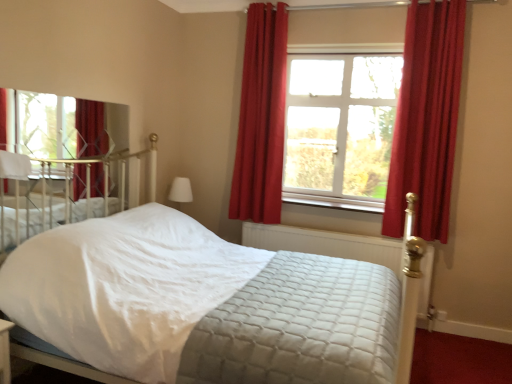
Question: From a real-world perspective, is quilted fabric mattress at center positioned under white quilted fabric bed at center based on gravity?

Choices:
 (A) no
 (B) yes

Answer: (B)

Question: Can white quilted fabric bed at center be found inside quilted fabric mattress at center?

Choices:
 (A) yes
 (B) no

Answer: (B)

Question: Could you tell me if quilted fabric mattress at center is facing white quilted fabric bed at center?

Choices:
 (A) no
 (B) yes

Answer: (B)

Question: Would you say quilted fabric mattress at center is a long distance from white quilted fabric bed at center?

Choices:
 (A) yes
 (B) no

Answer: (B)

Question: Can you confirm if quilted fabric mattress at center is positioned to the right of white quilted fabric bed at center?

Choices:
 (A) yes
 (B) no

Answer: (A)

Question: Looking at their shapes, would you say clear glass window at center, arranged as the first window when viewed from the back, is wider or thinner than white quilted fabric bed at center?

Choices:
 (A) thin
 (B) wide

Answer: (A)

Question: Relative to white quilted fabric bed at center, is clear glass window at center, the 1th window from the right, in front or behind?

Choices:
 (A) front
 (B) behind

Answer: (B)

Question: Is clear glass window at center, acting as the second window starting from the front, to the left or to the right of white quilted fabric bed at center in the image?

Choices:
 (A) left
 (B) right

Answer: (B)

Question: From the image's perspective, is clear glass window at center, acting as the second window starting from the front, located above or below white quilted fabric bed at center?

Choices:
 (A) above
 (B) below

Answer: (A)

Question: Considering the positions of quilted fabric mattress at center and clear glass window at center, which is the 2th window from left to right, in the image, is quilted fabric mattress at center taller or shorter than clear glass window at center, which is the 2th window from left to right,?

Choices:
 (A) tall
 (B) short

Answer: (B)

Question: Is point (358, 241) closer or farther from the camera than point (375, 94)?

Choices:
 (A) closer
 (B) farther

Answer: (A)

Question: From a real-world perspective, relative to clear glass window at center, acting as the second window starting from the front, is quilted fabric mattress at center vertically above or below?

Choices:
 (A) above
 (B) below

Answer: (B)

Question: Considering the relative positions of quilted fabric mattress at center and clear glass window at center, arranged as the first window when viewed from the back, in the image provided, is quilted fabric mattress at center to the left or to the right of clear glass window at center, arranged as the first window when viewed from the back,?

Choices:
 (A) right
 (B) left

Answer: (B)

Question: From the image's perspective, is clear glass mirror at upper left, which is counted as the 2th window, starting from the right, positioned above or below velvet red curtain at upper right, arranged as the 1th curtain when viewed from the left?

Choices:
 (A) below
 (B) above

Answer: (A)

Question: Is point (18, 124) closer or farther from the camera than point (241, 165)?

Choices:
 (A) closer
 (B) farther

Answer: (A)